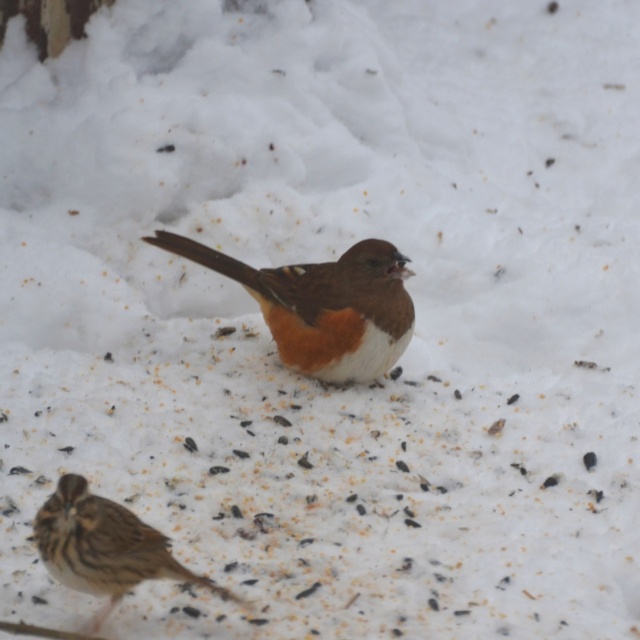
Measure the distance between brown feathered sparrow at center and brown speckled sparrow at lower left.

A distance of 74.39 centimeters exists between brown feathered sparrow at center and brown speckled sparrow at lower left.

This screenshot has width=640, height=640. I want to click on brown feathered sparrow at center, so click(323, 307).